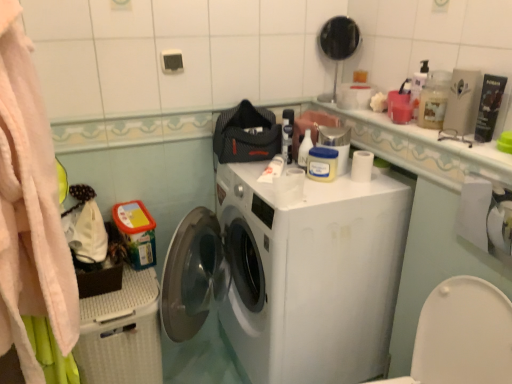
What do you see at coordinates (485, 215) in the screenshot? I see `white matte toilet paper at lower right` at bounding box center [485, 215].

Measure the distance between point (86, 354) and camera.

4.44 feet.

Find the location of a particular element. Image resolution: width=512 pixels, height=384 pixels. metallic silver container at upper right is located at coordinates (336, 143).

You are a GUI agent. You are given a task and a screenshot of the screen. Output one action in this format:
    pyautogui.click(x=<x>, y=<y>)
    Task: Click on the white glossy countertop at upper right
    
    Given the screenshot: What is the action you would take?
    tap(423, 149)

You are a GUI agent. You are given a task and a screenshot of the screen. Output one action in this format:
    pyautogui.click(x=<x>, y=<y>)
    Task: Click on the white matte washing machine at center
    
    Given the screenshot: What is the action you would take?
    pyautogui.click(x=308, y=275)

Considering the relative positions of matte black mirror at upper center and white glossy bottle at upper center, which appears as the second cleaning product when viewed from the front, in the image provided, is matte black mirror at upper center to the left of white glossy bottle at upper center, which appears as the second cleaning product when viewed from the front, from the viewer's perspective?

No, matte black mirror at upper center is not to the left of white glossy bottle at upper center, which appears as the second cleaning product when viewed from the front.

Find the location of a particular element. mirror lying above the white glossy bottle at upper center, marked as the first cleaning product in a back-to-front arrangement (from the image's perspective) is located at coordinates (339, 37).

Is the position of matte black mirror at upper center more distant than that of white glossy bottle at upper center, which appears as the second cleaning product when viewed from the front?

Yes, matte black mirror at upper center is further from the viewer.

Is point (342, 46) farther from viewer compared to point (312, 142)?

Yes.

From the picture: Considering the relative sizes of white glossy bottle at upper center, positioned as the 1th cleaning product in left-to-right order, and white matte toilet paper at lower right in the image provided, is white glossy bottle at upper center, positioned as the 1th cleaning product in left-to-right order, smaller than white matte toilet paper at lower right?

Correct, white glossy bottle at upper center, positioned as the 1th cleaning product in left-to-right order, occupies less space than white matte toilet paper at lower right.

Considering the relative sizes of white glossy bottle at upper center, marked as the first cleaning product in a back-to-front arrangement, and white matte toilet paper at lower right in the image provided, is white glossy bottle at upper center, marked as the first cleaning product in a back-to-front arrangement, taller than white matte toilet paper at lower right?

In fact, white glossy bottle at upper center, marked as the first cleaning product in a back-to-front arrangement, may be shorter than white matte toilet paper at lower right.

Considering the relative sizes of white glossy bottle at upper center, acting as the 2th cleaning product starting from the right, and white matte toilet paper at lower right in the image provided, is white glossy bottle at upper center, acting as the 2th cleaning product starting from the right, thinner than white matte toilet paper at lower right?

Yes, white glossy bottle at upper center, acting as the 2th cleaning product starting from the right, is thinner than white matte toilet paper at lower right.

Which of these two, translucent plastic bottle at upper right, which is the first cleaning product in right-to-left order, or metallic silver container at upper right, is bigger?

With larger size is metallic silver container at upper right.

From the image's perspective, which is above, translucent plastic bottle at upper right, acting as the 2th cleaning product starting from the left, or metallic silver container at upper right?

From the image's view, translucent plastic bottle at upper right, acting as the 2th cleaning product starting from the left, is above.

Considering the positions of point (449, 74) and point (340, 168), is point (449, 74) closer or farther from the camera than point (340, 168)?

Point (449, 74).

Looking at this image, which is more to the left, soft pink towel at left or white glossy bottle at upper center, marked as the first cleaning product in a back-to-front arrangement?

soft pink towel at left.

What's the angular difference between soft pink towel at left and white glossy bottle at upper center, acting as the 2th cleaning product starting from the right,'s facing directions?

There is a 46.4-degree angle between the facing directions of soft pink towel at left and white glossy bottle at upper center, acting as the 2th cleaning product starting from the right.

Considering the sizes of soft pink towel at left and white glossy bottle at upper center, marked as the first cleaning product in a back-to-front arrangement, in the image, is soft pink towel at left wider or thinner than white glossy bottle at upper center, marked as the first cleaning product in a back-to-front arrangement,?

Clearly, soft pink towel at left has more width compared to white glossy bottle at upper center, marked as the first cleaning product in a back-to-front arrangement.

Considering the sizes of objects soft pink towel at left and white glossy bottle at upper center, which appears as the second cleaning product when viewed from the front, in the image provided, who is bigger, soft pink towel at left or white glossy bottle at upper center, which appears as the second cleaning product when viewed from the front,?

soft pink towel at left.

Is white glossy countertop at upper right surrounding soft pink towel at left?

No, soft pink towel at left is not inside white glossy countertop at upper right.

Is white glossy countertop at upper right to the left or to the right of soft pink towel at left in the image?

white glossy countertop at upper right is to the right of soft pink towel at left.

From the image's perspective, which one is positioned higher, white glossy countertop at upper right or soft pink towel at left?

white glossy countertop at upper right is shown above in the image.

The width and height of the screenshot is (512, 384). In order to click on clothing in front of the white glossy countertop at upper right in this screenshot , I will do `click(29, 210)`.

Which object is positioned more to the right, matte black mirror at upper center or soft pink towel at left?

Positioned to the right is matte black mirror at upper center.

Would you say matte black mirror at upper center is a long distance from soft pink towel at left?

Yes, matte black mirror at upper center is far from soft pink towel at left.

Considering the sizes of objects matte black mirror at upper center and soft pink towel at left in the image provided, who is smaller, matte black mirror at upper center or soft pink towel at left?

matte black mirror at upper center is smaller.

Between matte black mirror at upper center and soft pink towel at left, which one has less height?

matte black mirror at upper center is shorter.

Find the location of a particular element. dish washer that is on the left side of matte black mirror at upper center is located at coordinates (121, 333).

Is white plastic dish washer at lower left completely or partially inside matte black mirror at upper center?

No, white plastic dish washer at lower left is not inside matte black mirror at upper center.

Which object is closer to the camera, matte black mirror at upper center or white plastic dish washer at lower left?

white plastic dish washer at lower left is more forward.

Can you confirm if matte black mirror at upper center is wider than white plastic dish washer at lower left?

No.

There is a matte black mirror at upper center. In order to click on the 2nd cleaning product below it (from a real-world perspective) in this screenshot , I will do coord(305,149).

Locate an element on the screen. toilet paper lying below the white glossy bottle at upper center, which appears as the second cleaning product when viewed from the front (from the image's perspective) is located at coordinates (485, 215).

In the scene shown: Based on their spatial positions, is translucent plastic bottle at upper right, which is the first cleaning product in right-to-left order, or white matte washing machine at center further from white glossy bottle at upper center, marked as the first cleaning product in a back-to-front arrangement?

white matte washing machine at center is positioned further to the anchor white glossy bottle at upper center, marked as the first cleaning product in a back-to-front arrangement.

In the scene shown: Estimate the real-world distances between objects in this image. Which object is further from matte black mirror at upper center, translucent plastic bottle at upper right, the 2th cleaning product when ordered from back to front, or white plastic dish washer at lower left?

white plastic dish washer at lower left.

When comparing their distances from white plastic dish washer at lower left, does white matte toilet paper at lower right or matte black mirror at upper center seem further?

matte black mirror at upper center.

Based on their spatial positions, is white glossy bottle at upper center, which appears as the second cleaning product when viewed from the front, or soft pink towel at left closer to white matte toilet paper at lower right?

white glossy bottle at upper center, which appears as the second cleaning product when viewed from the front, lies closer to white matte toilet paper at lower right than the other object.

Based on their spatial positions, is white matte toilet paper at lower right or matte black mirror at upper center further from soft pink towel at left?

white matte toilet paper at lower right lies further to soft pink towel at left than the other object.

When comparing their distances from white matte washing machine at center, does translucent plastic bottle at upper right, acting as the 2th cleaning product starting from the left, or white plastic dish washer at lower left seem further?

translucent plastic bottle at upper right, acting as the 2th cleaning product starting from the left, is further to white matte washing machine at center.

Looking at the image, which one is located further to white glossy countertop at upper right, metallic silver container at upper right or soft pink towel at left?

soft pink towel at left lies further to white glossy countertop at upper right than the other object.

Based on their spatial positions, is matte black mirror at upper center or white matte toilet paper at lower right further from soft pink towel at left?

white matte toilet paper at lower right is positioned further to the anchor soft pink towel at left.

Where is `cleaning product between white glossy countertop at upper right and white glossy bottle at upper center, acting as the 2th cleaning product starting from the right, along the z-axis`? cleaning product between white glossy countertop at upper right and white glossy bottle at upper center, acting as the 2th cleaning product starting from the right, along the z-axis is located at coordinates (434, 99).

This screenshot has width=512, height=384. Find the location of `appliance between white matte toilet paper at lower right and matte black mirror at upper center in the front-back direction`. appliance between white matte toilet paper at lower right and matte black mirror at upper center in the front-back direction is located at coordinates (336, 143).

The width and height of the screenshot is (512, 384). Find the location of `dish washer between soft pink towel at left and white glossy bottle at upper center, marked as the first cleaning product in a back-to-front arrangement, in the front-back direction`. dish washer between soft pink towel at left and white glossy bottle at upper center, marked as the first cleaning product in a back-to-front arrangement, in the front-back direction is located at coordinates (121, 333).

Locate an element on the screen. The height and width of the screenshot is (384, 512). appliance located between white matte washing machine at center and white matte toilet paper at lower right in the left-right direction is located at coordinates (336, 143).